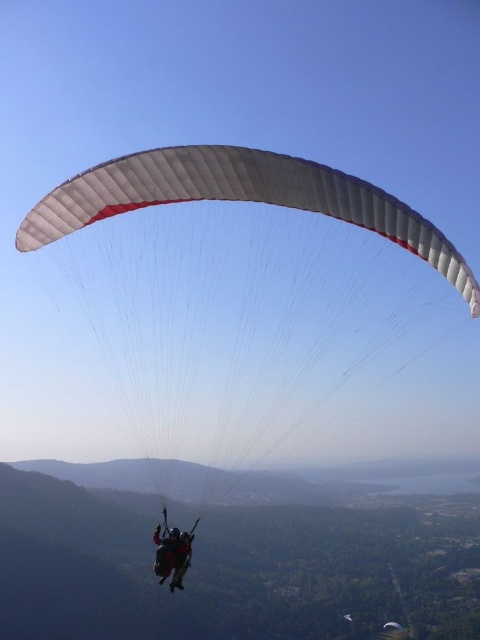
Question: In this image, where is white matte parachute at center located relative to black fabric parachute at center?

Choices:
 (A) left
 (B) right

Answer: (A)

Question: Which of the following is the farthest from the observer?

Choices:
 (A) (131, 307)
 (B) (159, 568)

Answer: (A)

Question: Can you confirm if white matte parachute at center is bigger than black fabric parachute at center?

Choices:
 (A) no
 (B) yes

Answer: (B)

Question: Which point appears farthest from the camera in this image?

Choices:
 (A) (189, 548)
 (B) (231, 240)

Answer: (B)

Question: Is white matte parachute at center positioned at the back of black fabric parachute at center?

Choices:
 (A) yes
 (B) no

Answer: (B)